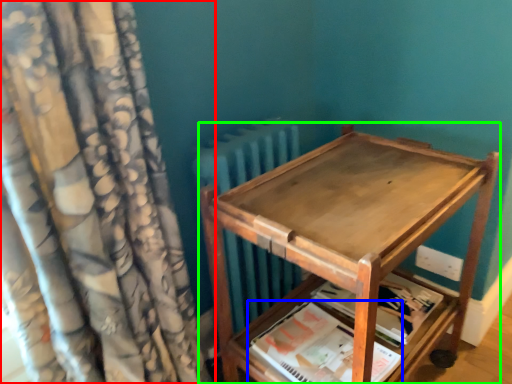
Question: Which object is positioned closest to curtain (highlighted by a red box)? Select from paperback book (highlighted by a blue box) and furniture (highlighted by a green box).

Choices:
 (A) paperback book
 (B) furniture

Answer: (B)